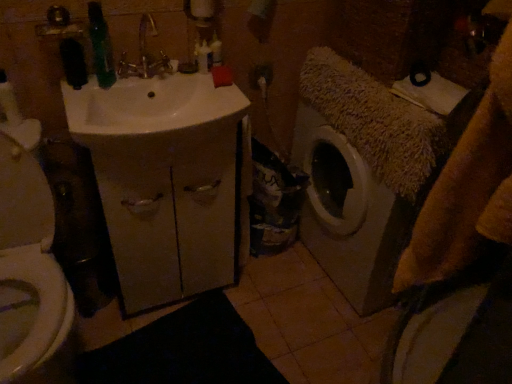
Find the location of a particular element. The width and height of the screenshot is (512, 384). free spot to the right of white matte cabinet at center is located at coordinates (266, 303).